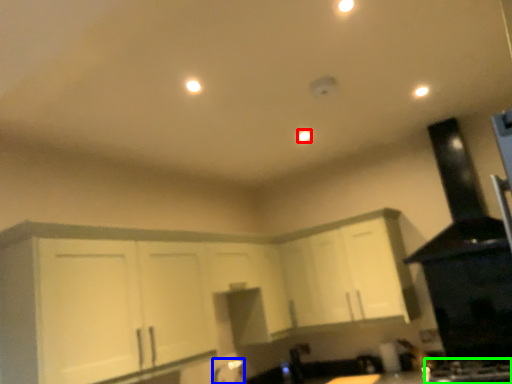
Question: Which is farther away from light (highlighted by a red box)? faucet (highlighted by a blue box) or gas stove (highlighted by a green box)?

Choices:
 (A) faucet
 (B) gas stove

Answer: (A)